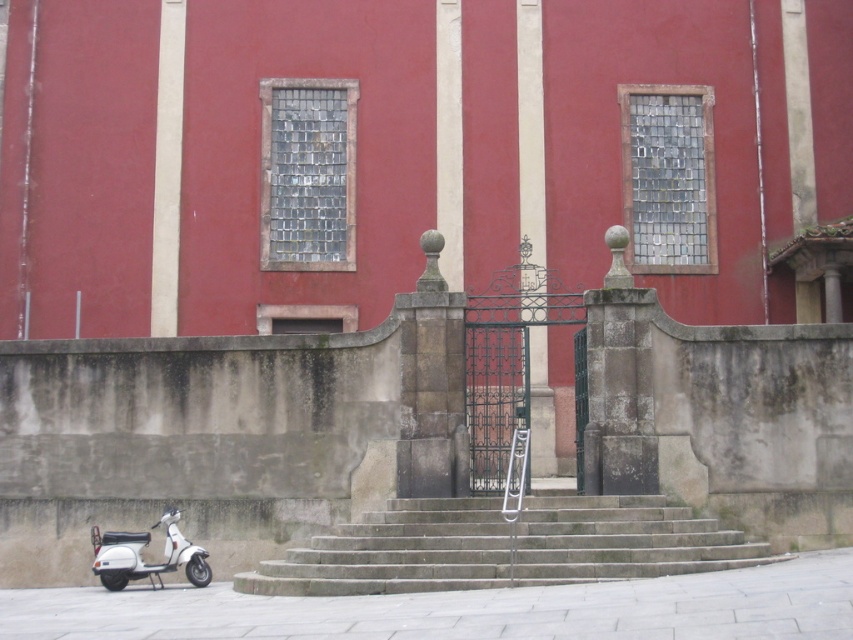
Between gray stone stairs at center and white matte scooter at lower left, which one has less height?

Standing shorter between the two is white matte scooter at lower left.

Identify the location of gray stone stairs at center. The width and height of the screenshot is (853, 640). (395, 552).

This screenshot has width=853, height=640. What are the coordinates of `gray stone stairs at center` in the screenshot? It's located at (395, 552).